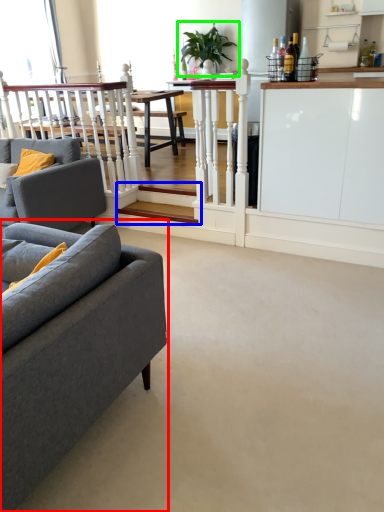
Question: Estimate the real-world distances between objects in this image. Which object is closer to studio couch (highlighted by a red box), stairwell (highlighted by a blue box) or houseplant (highlighted by a green box)?

Choices:
 (A) stairwell
 (B) houseplant

Answer: (A)